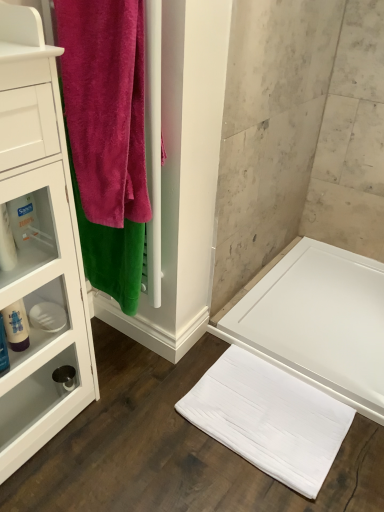
Question: Is velvety pink towel at left positioned in front of translucent plastic bottle at left, the 2th toiletry positioned from the top?

Choices:
 (A) no
 (B) yes

Answer: (B)

Question: Is velvety pink towel at left shorter than translucent plastic bottle at left, the second toiletry in the bottom-to-top sequence?

Choices:
 (A) yes
 (B) no

Answer: (B)

Question: Considering the relative sizes of velvety pink towel at left and translucent plastic bottle at left, the second toiletry in the bottom-to-top sequence, in the image provided, is velvety pink towel at left taller than translucent plastic bottle at left, the second toiletry in the bottom-to-top sequence,?

Choices:
 (A) yes
 (B) no

Answer: (A)

Question: Considering the relative positions of velvety pink towel at left and translucent plastic bottle at left, the 2th toiletry positioned from the top, in the image provided, is velvety pink towel at left behind translucent plastic bottle at left, the 2th toiletry positioned from the top,?

Choices:
 (A) yes
 (B) no

Answer: (B)

Question: From the image's perspective, is velvety pink towel at left beneath translucent plastic bottle at left, the second toiletry in the bottom-to-top sequence?

Choices:
 (A) no
 (B) yes

Answer: (A)

Question: Can you confirm if velvety pink towel at left is bigger than translucent plastic bottle at left, the 2th toiletry from the back?

Choices:
 (A) no
 (B) yes

Answer: (B)

Question: Is white glossy cabinet at left smaller than velvety pink towel at left?

Choices:
 (A) no
 (B) yes

Answer: (A)

Question: Is white glossy cabinet at left positioned with its back to velvety pink towel at left?

Choices:
 (A) yes
 (B) no

Answer: (B)

Question: Is white glossy cabinet at left completely or partially outside of velvety pink towel at left?

Choices:
 (A) yes
 (B) no

Answer: (A)

Question: Is there a large distance between white glossy cabinet at left and velvety pink towel at left?

Choices:
 (A) no
 (B) yes

Answer: (A)

Question: From a real-world perspective, is white glossy cabinet at left located beneath velvety pink towel at left?

Choices:
 (A) no
 (B) yes

Answer: (B)

Question: Does white glossy cabinet at left have a larger size compared to velvety pink towel at left?

Choices:
 (A) yes
 (B) no

Answer: (A)

Question: Is translucent plastic bottle at left outside translucent plastic bottle at left, positioned as the second toiletry in front-to-back order?

Choices:
 (A) yes
 (B) no

Answer: (A)